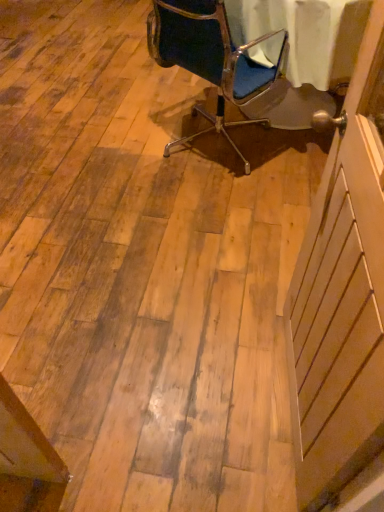
The image size is (384, 512). I want to click on vacant space that's between white wood screen door at right and blue fabric chair at upper center, so click(x=231, y=241).